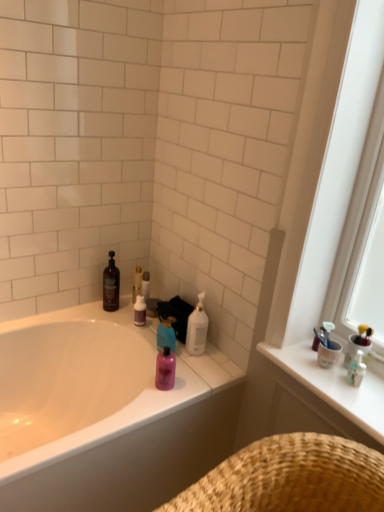
Locate an element on the screen. The height and width of the screenshot is (512, 384). vacant area on top of white glossy counter top at upper right (from a real-world perspective) is located at coordinates (331, 375).